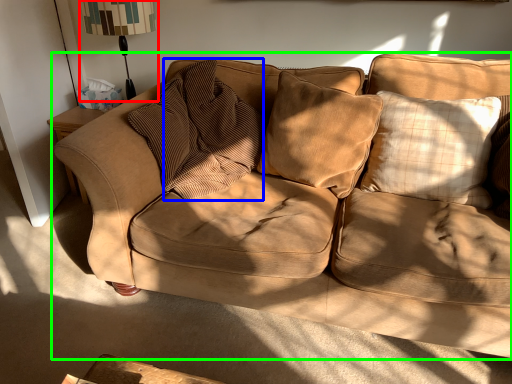
Question: Based on their relative distances, which object is farther from table lamp (highlighted by a red box)? Choose from pillow (highlighted by a blue box) and studio couch (highlighted by a green box).

Choices:
 (A) pillow
 (B) studio couch

Answer: (B)